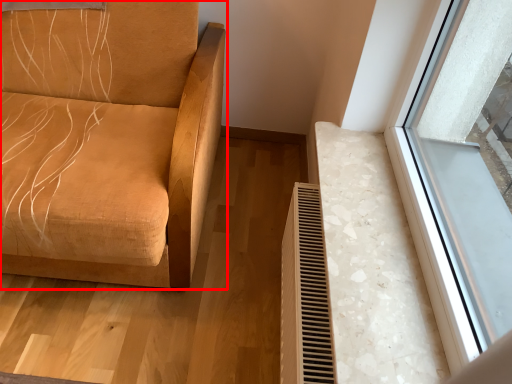
Question: Observing the image, what is the correct spatial positioning of furniture (annotated by the red box) in reference to radiator?

Choices:
 (A) right
 (B) left

Answer: (B)